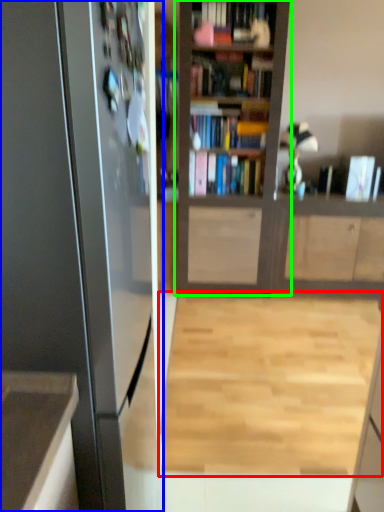
Question: Which is nearer to the plain (highlighted by a red box)? appliance (highlighted by a blue box) or bookcase (highlighted by a green box).

Choices:
 (A) appliance
 (B) bookcase

Answer: (B)